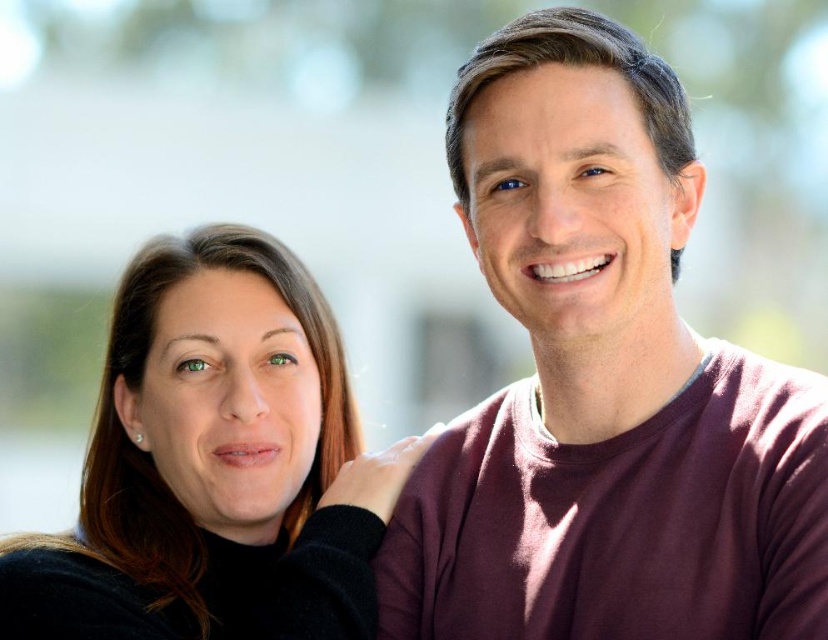
Question: Does maroon sweater at upper right have a greater width compared to matte black sweater at left?

Choices:
 (A) no
 (B) yes

Answer: (A)

Question: Which point appears closest to the camera in this image?

Choices:
 (A) (751, 620)
 (B) (296, 500)

Answer: (A)

Question: Can you confirm if maroon sweater at upper right is positioned above matte black sweater at left?

Choices:
 (A) no
 (B) yes

Answer: (B)

Question: Is maroon sweater at upper right further to the viewer compared to matte black sweater at left?

Choices:
 (A) yes
 (B) no

Answer: (B)